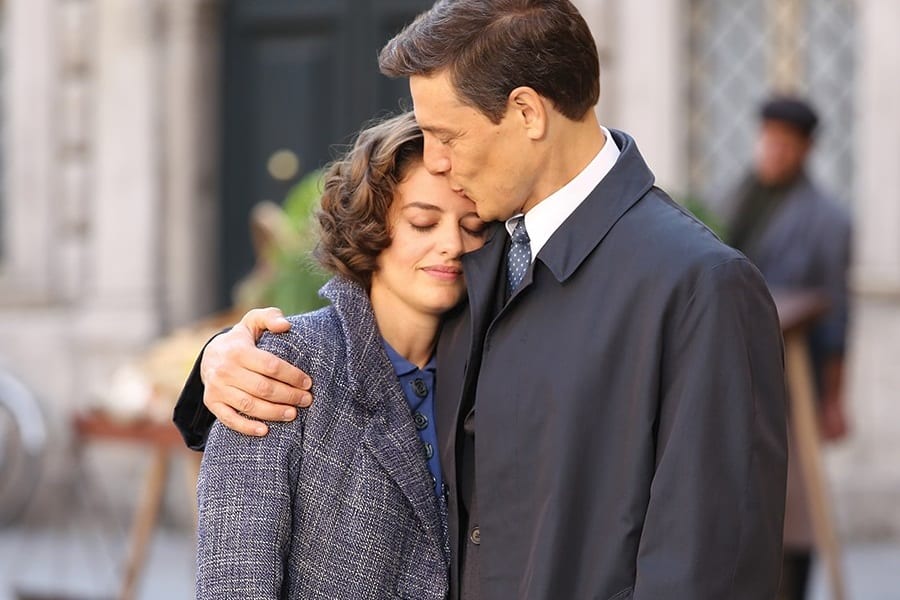
Locate an element on the screen. The image size is (900, 600). wall is located at coordinates (122, 101).